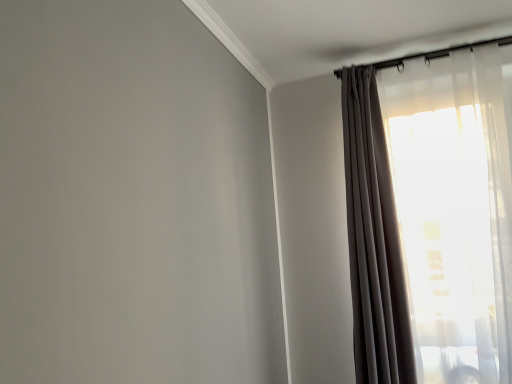
Question: From a real-world perspective, is translucent sheer curtain at upper right, arranged as the second curtain when viewed from the left, physically above matte gray curtain at upper right, the 2th curtain positioned from the right?

Choices:
 (A) yes
 (B) no

Answer: (A)

Question: Is translucent sheer curtain at upper right, arranged as the second curtain when viewed from the left, directly adjacent to matte gray curtain at upper right, which is counted as the 1th curtain, starting from the left?

Choices:
 (A) yes
 (B) no

Answer: (B)

Question: Is translucent sheer curtain at upper right, arranged as the second curtain when viewed from the left, thinner than matte gray curtain at upper right, which is counted as the 1th curtain, starting from the left?

Choices:
 (A) yes
 (B) no

Answer: (A)

Question: Does translucent sheer curtain at upper right, arranged as the second curtain when viewed from the left, have a greater height compared to matte gray curtain at upper right, the 2th curtain positioned from the right?

Choices:
 (A) yes
 (B) no

Answer: (A)

Question: Does translucent sheer curtain at upper right, marked as the 1th curtain in a right-to-left arrangement, appear on the right side of matte gray curtain at upper right, which is counted as the 1th curtain, starting from the left?

Choices:
 (A) yes
 (B) no

Answer: (A)

Question: From the image's perspective, does translucent sheer curtain at upper right, arranged as the second curtain when viewed from the left, appear higher than matte gray curtain at upper right, the 2th curtain positioned from the right?

Choices:
 (A) yes
 (B) no

Answer: (A)

Question: Is matte gray curtain at upper right, which is counted as the 1th curtain, starting from the left, turned away from translucent sheer curtain at upper right, arranged as the second curtain when viewed from the left?

Choices:
 (A) yes
 (B) no

Answer: (B)

Question: From a real-world perspective, is matte gray curtain at upper right, the 2th curtain positioned from the right, located higher than translucent sheer curtain at upper right, arranged as the second curtain when viewed from the left?

Choices:
 (A) no
 (B) yes

Answer: (A)

Question: From the image's perspective, is matte gray curtain at upper right, which is counted as the 1th curtain, starting from the left, above translucent sheer curtain at upper right, arranged as the second curtain when viewed from the left?

Choices:
 (A) yes
 (B) no

Answer: (B)

Question: Can you confirm if matte gray curtain at upper right, the 2th curtain positioned from the right, is smaller than translucent sheer curtain at upper right, marked as the 1th curtain in a right-to-left arrangement?

Choices:
 (A) no
 (B) yes

Answer: (B)

Question: Considering the relative sizes of matte gray curtain at upper right, which is counted as the 1th curtain, starting from the left, and translucent sheer curtain at upper right, marked as the 1th curtain in a right-to-left arrangement, in the image provided, is matte gray curtain at upper right, which is counted as the 1th curtain, starting from the left, wider than translucent sheer curtain at upper right, marked as the 1th curtain in a right-to-left arrangement,?

Choices:
 (A) yes
 (B) no

Answer: (A)

Question: Would you say matte gray curtain at upper right, the 2th curtain positioned from the right, is a long distance from translucent sheer curtain at upper right, arranged as the second curtain when viewed from the left?

Choices:
 (A) yes
 (B) no

Answer: (B)

Question: Is point coord(476,372) positioned closer to the camera than point coord(358,375)?

Choices:
 (A) closer
 (B) farther

Answer: (A)